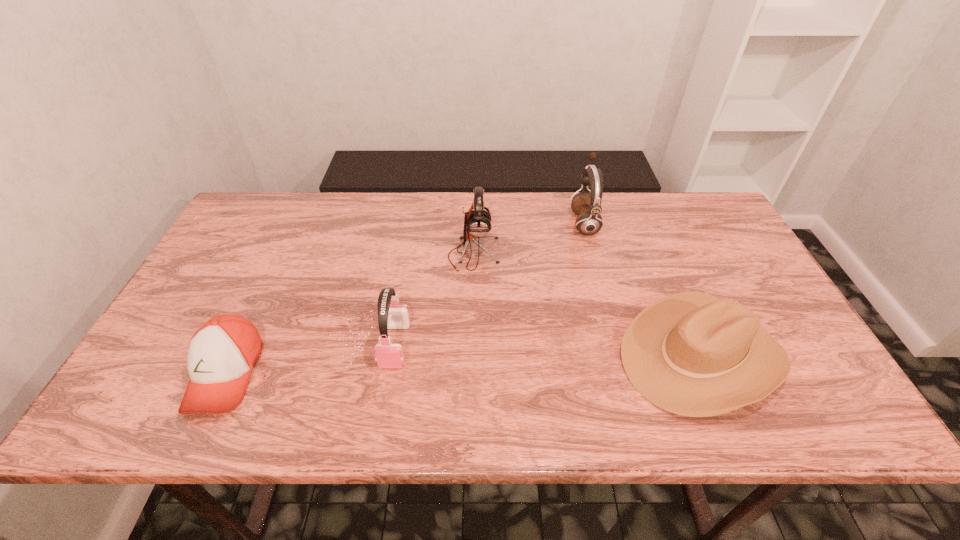
Locate an element on the screen. The width and height of the screenshot is (960, 540). the rightmost earphone is located at coordinates (587, 205).

Locate an element on the screen. The width and height of the screenshot is (960, 540). the second earphone from left to right is located at coordinates (477, 223).

I want to click on the fourth object from right to left, so coord(388,355).

Locate an element on the screen. This screenshot has height=540, width=960. the nearest earphone is located at coordinates (388, 355).

This screenshot has height=540, width=960. I want to click on the second shortest object, so click(x=692, y=354).

This screenshot has height=540, width=960. In order to click on the leftmost object in this screenshot , I will do pyautogui.click(x=221, y=354).

The width and height of the screenshot is (960, 540). In order to click on the shortest object in this screenshot , I will do `click(221, 354)`.

Identify the location of vacant space located 0.100m on the ear pads of the rightmost earphone. The width and height of the screenshot is (960, 540). (539, 222).

The height and width of the screenshot is (540, 960). I want to click on vacant space situated on the ear pads of the rightmost earphone, so click(522, 222).

You are a GUI agent. You are given a task and a screenshot of the screen. Output one action in this format:
    pyautogui.click(x=<x>, y=<y>)
    Task: Click on the free location located on the ear pads of the rightmost earphone
    The image size is (960, 540).
    Given the screenshot: What is the action you would take?
    pyautogui.click(x=516, y=222)